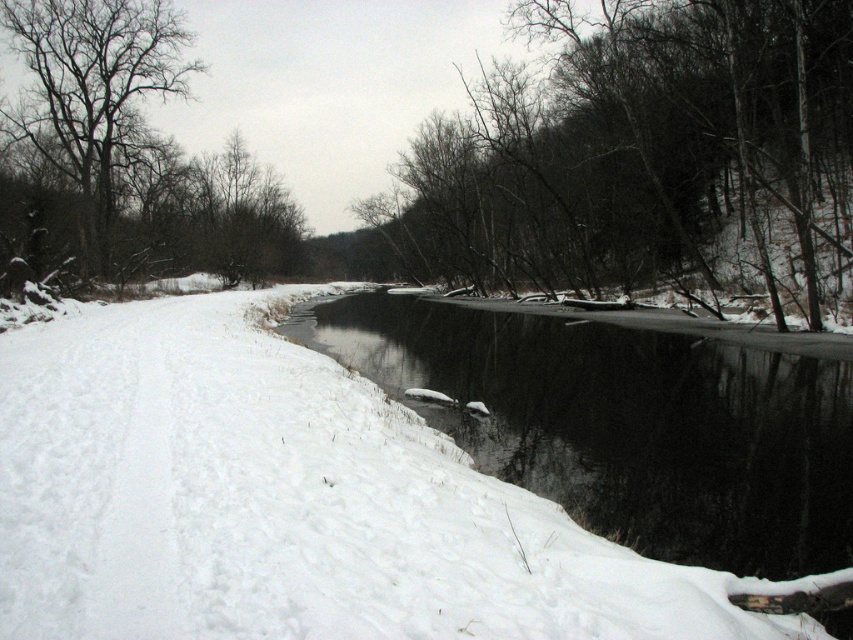
You are standing in the winter scene and want to walk from the snow on the left to the river on the right. Which point, point (695, 179) or point (730, 365), is closer to you as you start walking?

Point (695, 179) is closer to you because it is further to the viewer than point (730, 365), meaning it is physically nearer in the scene.

You are an observer standing in the snow on the left side of the scene. You want to walk to the river in the center. Which object, the dark brown bark tree at center or the bare branches at left, will you pass closer to as you move towards the river?

The dark brown bark tree at center is taller than the bare branches at left, so as you walk towards the river from the snow on the left, you will pass closer to the bare branches at left because it is shorter and likely closer to your path.

You are an ice skater planning to glide across the black ice at center and the bare branches at left. Which object is located to the right of the other?

The black ice at center is positioned on the right side of the bare branches at left.